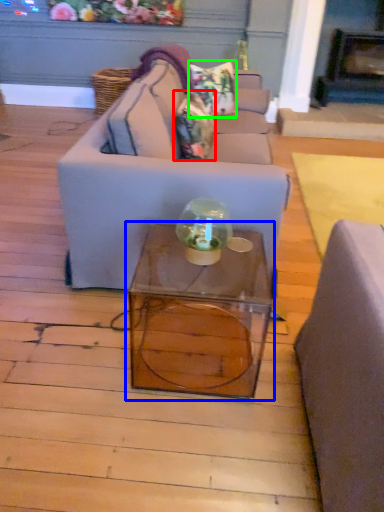
Question: Which is farther away from pillow (highlighted by a red box)? table (highlighted by a blue box) or pillow (highlighted by a green box)?

Choices:
 (A) table
 (B) pillow

Answer: (A)